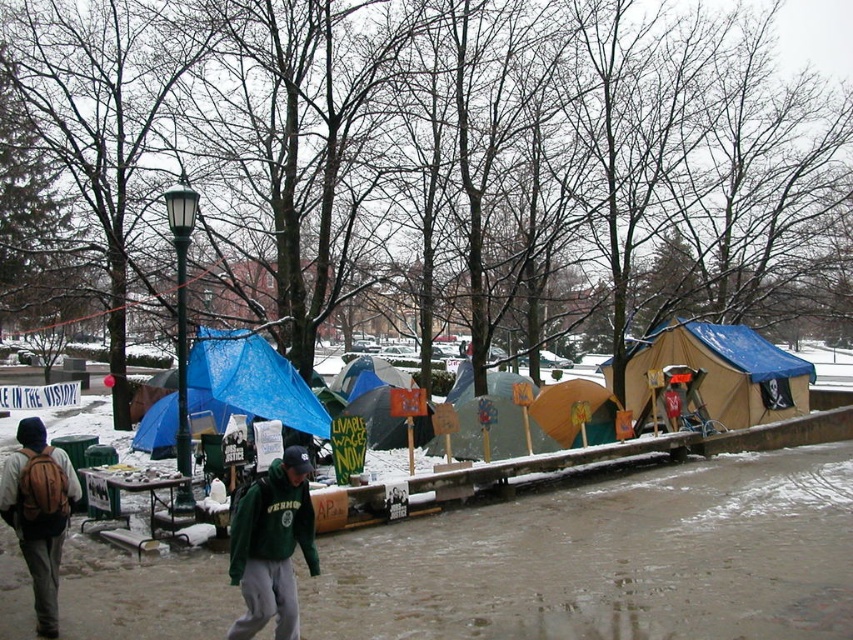
Based on the scene description, where is the blue tarp at center located in terms of its 2D coordinates?

The blue tarp at center is located at the 2D coordinates point (x=158, y=428).

You are standing at the campsite and want to take a photo that includes both the point at coordinates point (x=640, y=342) and the point at coordinates point (x=35, y=532). Based on their positions, which point should you focus on first to ensure both are in clear view?

You should focus on point (x=640, y=342) first because it is closer to the camera than point (x=35, y=532). Since it is closer, focusing on it will help ensure both points are in focus.

You are a hiker who just arrived at this winter campsite. You see a green fleece jacket at center and a yellow fabric tent at center. Which item is bigger in size?

The green fleece jacket at center has a larger size compared to the yellow fabric tent at center, so the green fleece jacket at center is bigger.